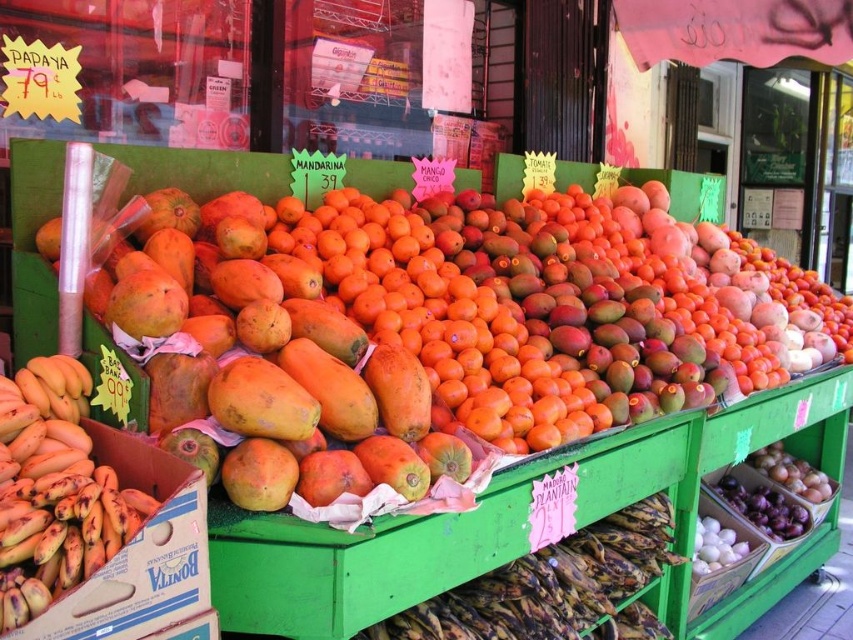
You are a customer at the fruit stand and want to pick up the ripe papaya at center and the yellow matte bananas at left. Which fruit should you reach for first if you want to grab the one that is closer to your left side?

The yellow matte bananas at left are closer to your left side since the ripe papaya at center is positioned on the right side of yellow matte bananas at left.

From the picture: You are a customer at the fruit stand and want to pick up the ripe papaya at center and the yellow matte bananas at left. Which fruit is positioned higher on the stand?

The ripe papaya at center is located above the yellow matte bananas at left, so it is positioned higher on the stand.